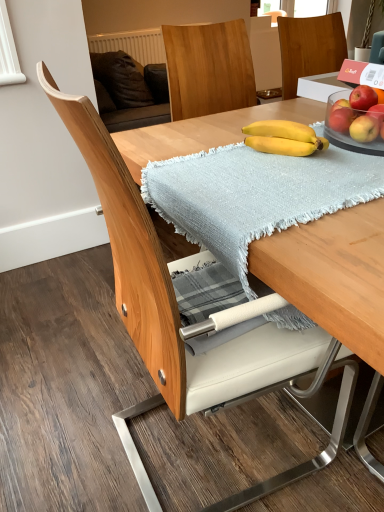
At what (x,y) coordinates should I click in order to perform the action: click on vacant space situated on the left part of red matte apple at upper right, acting as the second apple starting from the bottom. Please return your answer as a coordinate pair (x, y). The height and width of the screenshot is (512, 384). Looking at the image, I should click on click(301, 146).